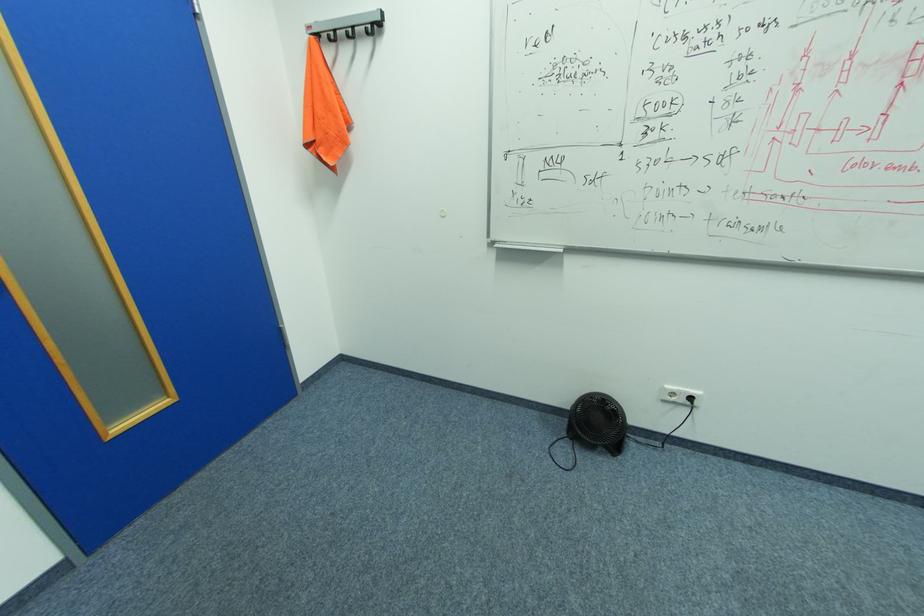
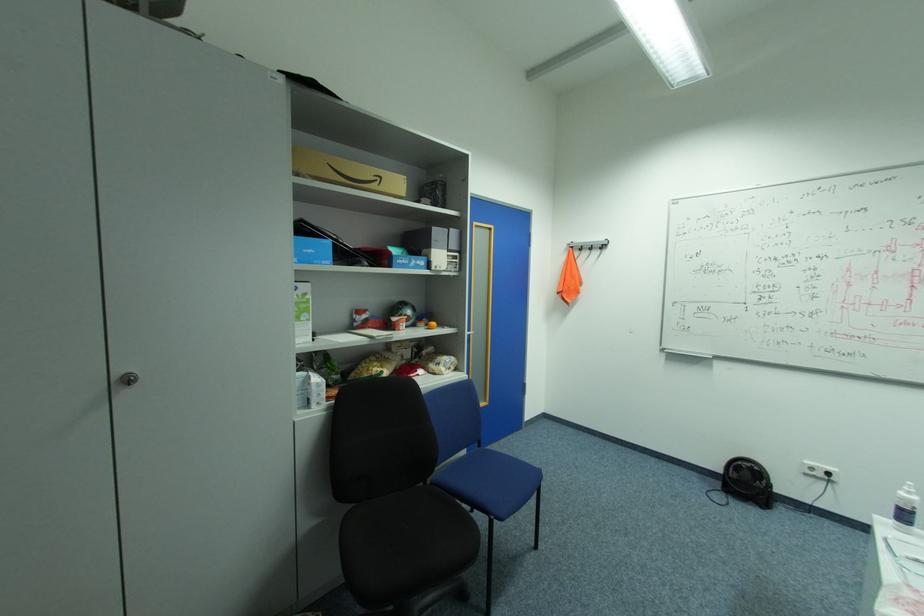
Where in the second image is the point corresponding to (x=568, y=423) from the first image?

(724, 484)